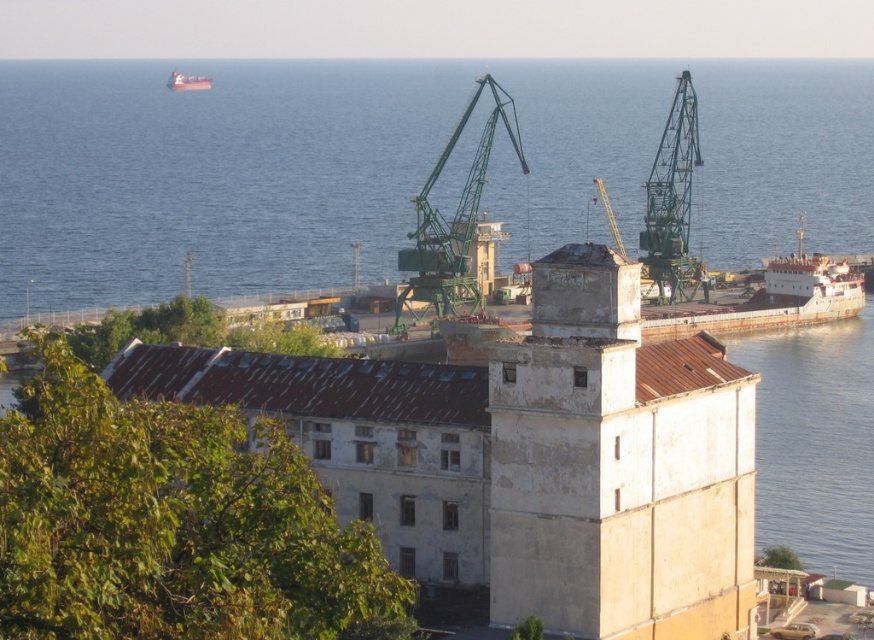
You are standing at the origin point of the image coordinate system. You want to move towards the green metallic crane at center. What are the coordinates you should head towards?

You should head towards the coordinates point at [453,221] to reach the green metallic crane at center.

You are a photographer planning to take a photo of the white concrete tower at center and the green metallic crane at upper right. Based on their positions, which object will appear higher in your photo?

The green metallic crane at upper right will appear higher in the photo since it is positioned above the white concrete tower at center.